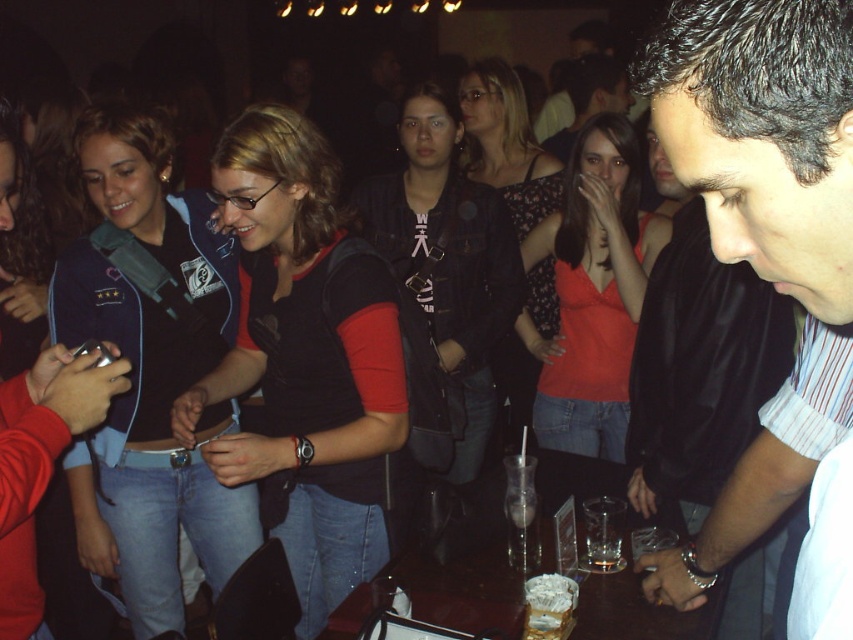
You are a fashion designer observing the clothing items in the scene. Which clothing item, the denim jacket at left or the matte red tank top at center, would you recommend to a client who wants something with a more voluminous silhouette?

The denim jacket at left has a larger size compared to the matte red tank top at center, so it would be the better choice for a more voluminous silhouette.

You are a photographer at the event and want to take a photo of both the black leather jacket at center and the smooth black shirt at center. Since you want to emphasize the larger object, which one should you focus on?

The smooth black shirt at center is larger than the black leather jacket at center, so you should focus on the smooth black shirt at center to emphasize the larger object.

You are at a social event and want to find the striped shirt at center. Where would you look relative to the smooth black shirt at center?

The striped shirt at center is located below the smooth black shirt at center, so you should look downward from the smooth black shirt at center to find it.